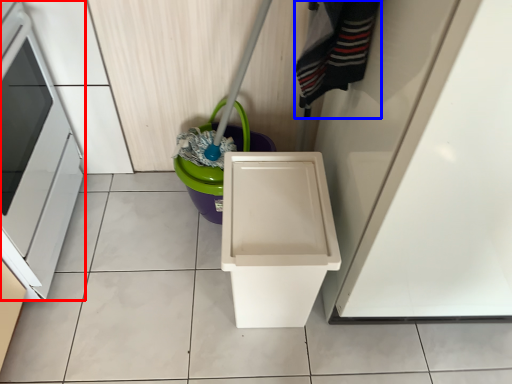
Question: Among these objects, which one is farthest to the camera, oven (highlighted by a red box) or clothing (highlighted by a blue box)?

Choices:
 (A) oven
 (B) clothing

Answer: (A)